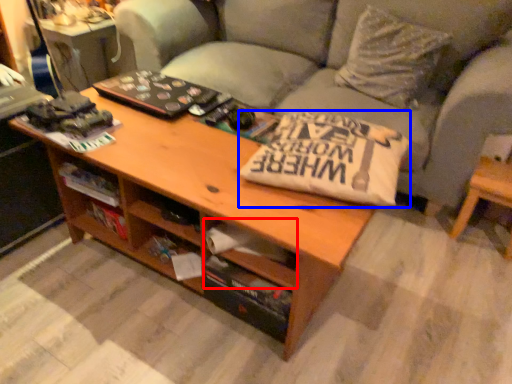
Question: Which object appears farthest to the camera in this image, drawer (highlighted by a red box) or pillow (highlighted by a blue box)?

Choices:
 (A) drawer
 (B) pillow

Answer: (A)